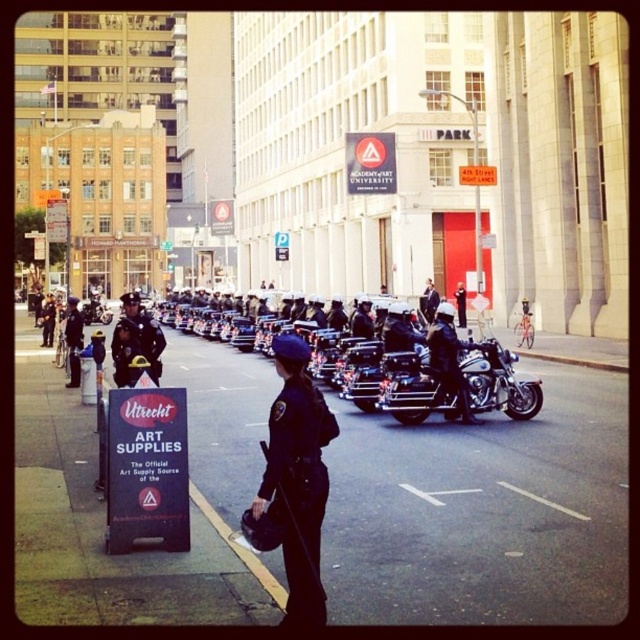
You are standing on the sidewalk and see two points marked in the image. The first point is at coordinate (291, 573) and the second is at (452, 404). Which point is closer to you?

Point (291, 573) is closer to the viewer than point (452, 404).

You are a pedestrian trying to cross the street at the intersection. You see a dark blue uniform at center and a white painted line at center. Which one is closer to you?

The dark blue uniform at center is bigger than the white painted line at center, so it is closer to you.